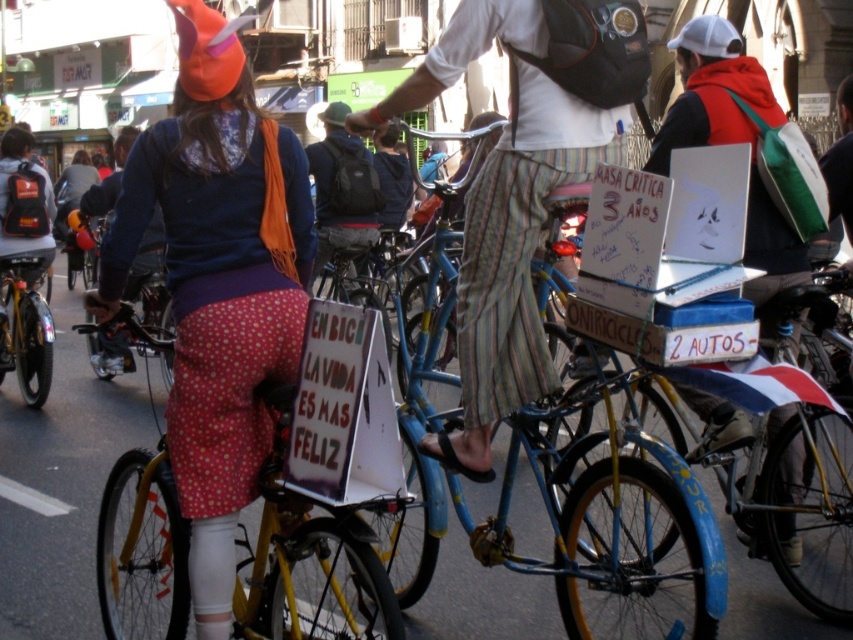
Can you confirm if polka dot fabric pants at center is smaller than striped cotton pants at center?

Actually, polka dot fabric pants at center might be larger than striped cotton pants at center.

Can you confirm if polka dot fabric pants at center is shorter than striped cotton pants at center?

Incorrect, polka dot fabric pants at center's height does not fall short of striped cotton pants at center's.

In order to click on polka dot fabric pants at center in this screenshot , I will do [x=218, y=284].

Based on the photo, is striped cotton pants at center wider than matte blue jacket at center?

In fact, striped cotton pants at center might be narrower than matte blue jacket at center.

Between striped cotton pants at center and matte blue jacket at center, which one has more height?

Standing taller between the two is matte blue jacket at center.

Does point (473, 307) come farther from viewer compared to point (157, 257)?

No, it is not.

You are a GUI agent. You are given a task and a screenshot of the screen. Output one action in this format:
    pyautogui.click(x=<x>, y=<y>)
    Task: Click on the striped cotton pants at center
    
    Given the screenshot: What is the action you would take?
    coord(503,212)

Is yellow matte bicycle at center smaller than shiny metallic bicycle at left?

No.

Where is `yellow matte bicycle at center`? This screenshot has width=853, height=640. yellow matte bicycle at center is located at coordinates (306, 556).

Locate an element on the screen. Image resolution: width=853 pixels, height=640 pixels. yellow matte bicycle at center is located at coordinates (306, 556).